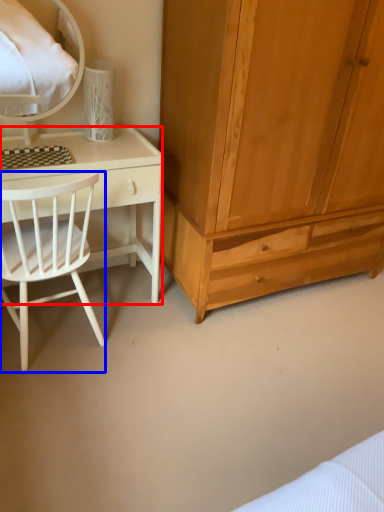
Question: Among these objects, which one is nearest to the camera, desk (highlighted by a red box) or chair (highlighted by a blue box)?

Choices:
 (A) desk
 (B) chair

Answer: (B)